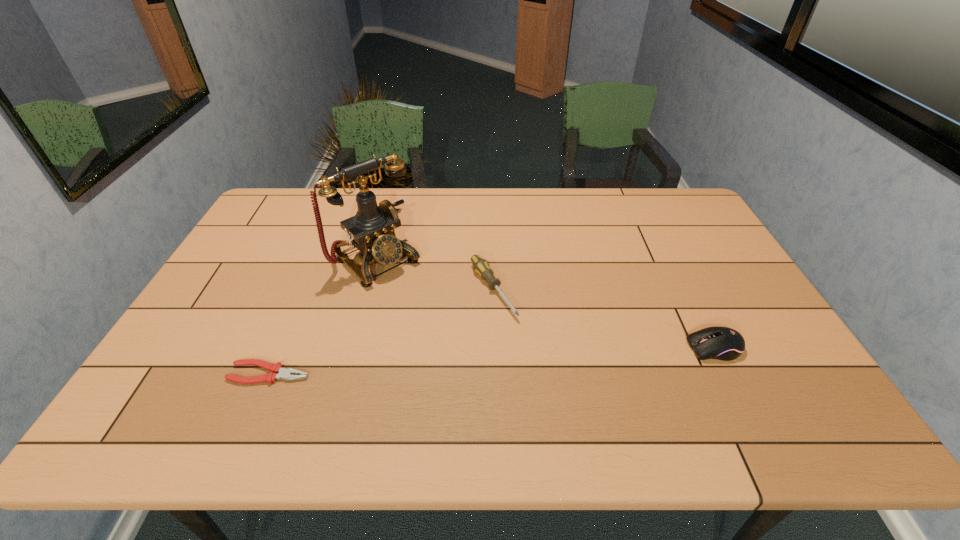
Find the location of a particular element. free point located 0.140m at the tip of the screwdriver is located at coordinates pos(532,356).

Where is `vacant space located 0.240m at the tip of the screwdriver`? The image size is (960, 540). vacant space located 0.240m at the tip of the screwdriver is located at coordinates (554, 387).

At what (x,y) coordinates should I click in order to perform the action: click on free region located 0.190m at the tip of the screwdriver. Please return your answer as a coordinate pair (x, y). This screenshot has width=960, height=540. Looking at the image, I should click on (542, 371).

Locate an element on the screen. object that is at the near edge is located at coordinates (283, 373).

Locate an element on the screen. object at the right edge is located at coordinates (722, 343).

Identify the location of vacant space at the far edge of the desktop. The width and height of the screenshot is (960, 540). (528, 211).

You are a GUI agent. You are given a task and a screenshot of the screen. Output one action in this format:
    pyautogui.click(x=<x>, y=<y>)
    Task: Click on the free space at the near edge of the desktop
    Image resolution: width=960 pixels, height=540 pixels.
    Given the screenshot: What is the action you would take?
    pyautogui.click(x=700, y=369)

In the image, there is a desktop. Identify the location of vacant space at the left edge. The image size is (960, 540). (264, 276).

Identify the location of vacant area at the right edge. The width and height of the screenshot is (960, 540). (720, 318).

Identify the location of vacant area that lies between the second shortest object and the telephone. The height and width of the screenshot is (540, 960). (435, 275).